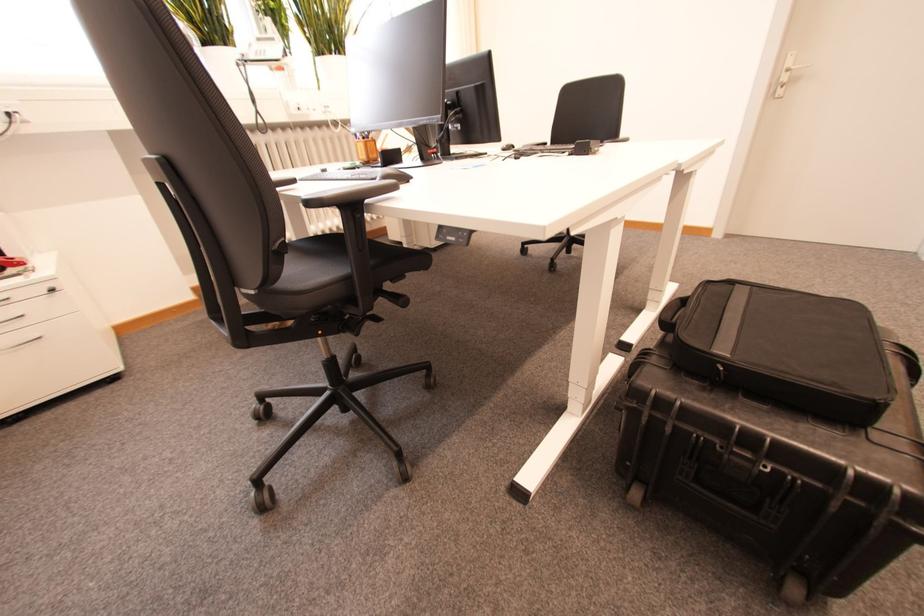
Find where to resting arm the black chair armrest. Please return your answer as a coordinate pair (x, y).

(355, 191)